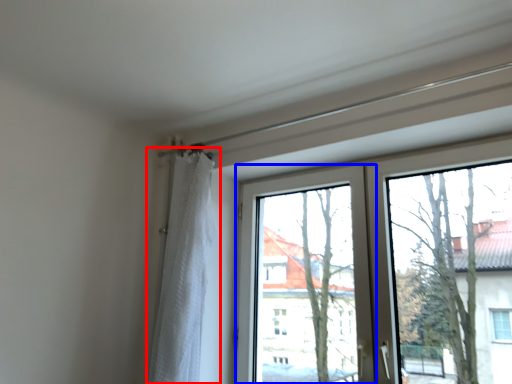
Question: Which object is further to the camera taking this photo, curtain (highlighted by a red box) or window screen (highlighted by a blue box)?

Choices:
 (A) curtain
 (B) window screen

Answer: (A)